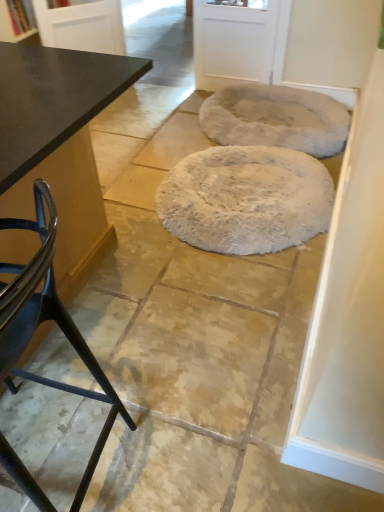
This screenshot has height=512, width=384. What do you see at coordinates (246, 199) in the screenshot? I see `white fluffy rug at center, acting as the second mat starting from the back` at bounding box center [246, 199].

Locate an element on the screen. The height and width of the screenshot is (512, 384). fuzzy gray mat at upper right, arranged as the 2th mat when viewed from the front is located at coordinates (276, 119).

Locate an element on the screen. The image size is (384, 512). white matte screen door at upper center, arranged as the first screen door when viewed from the right is located at coordinates (233, 42).

At what (x,y) coordinates should I click in order to perform the action: click on white fluffy rug at center, acting as the second mat starting from the back. Please return your answer as a coordinate pair (x, y). Image resolution: width=384 pixels, height=512 pixels. Looking at the image, I should click on (246, 199).

In the scene shown: Does glossy black table at upper left, the 2th screen door from the right, have a lesser width compared to black matte table at left?

Yes, glossy black table at upper left, the 2th screen door from the right, is thinner than black matte table at left.

Considering the relative positions of glossy black table at upper left, the 2th screen door from the right, and black matte table at left in the image provided, is glossy black table at upper left, the 2th screen door from the right, to the right of black matte table at left from the viewer's perspective?

In fact, glossy black table at upper left, the 2th screen door from the right, is to the left of black matte table at left.

Does glossy black table at upper left, the 2th screen door from the right, have a larger size compared to black matte table at left?

No, glossy black table at upper left, the 2th screen door from the right, is not bigger than black matte table at left.

From the image's perspective, is white fluffy rug at center, the 1th mat when ordered from front to back, on fuzzy gray mat at upper right, acting as the 1th mat starting from the back?

Incorrect, from the image's perspective, white fluffy rug at center, the 1th mat when ordered from front to back, is lower than fuzzy gray mat at upper right, acting as the 1th mat starting from the back.

From a real-world perspective, which object stands above the other?

From a 3D spatial view, fuzzy gray mat at upper right, acting as the 1th mat starting from the back, is above.

Does white fluffy rug at center, acting as the second mat starting from the back, have a lesser width compared to fuzzy gray mat at upper right, acting as the 1th mat starting from the back?

Indeed, white fluffy rug at center, acting as the second mat starting from the back, has a lesser width compared to fuzzy gray mat at upper right, acting as the 1th mat starting from the back.

I want to click on mat above the white fluffy rug at center, acting as the second mat starting from the back (from a real-world perspective), so click(x=276, y=119).

Looking at their sizes, would you say glossy black table at upper left, the 2th screen door from the right, is wider or thinner than white matte screen door at upper center, arranged as the first screen door when viewed from the right?

Clearly, glossy black table at upper left, the 2th screen door from the right, has less width compared to white matte screen door at upper center, arranged as the first screen door when viewed from the right.

From the image's perspective, which one is positioned higher, glossy black table at upper left, arranged as the first screen door when viewed from the left, or white matte screen door at upper center, placed as the 2th screen door when sorted from left to right?

glossy black table at upper left, arranged as the first screen door when viewed from the left.

Which object is further away from the camera, glossy black table at upper left, the 2th screen door from the right, or white matte screen door at upper center, arranged as the first screen door when viewed from the right?

Positioned behind is glossy black table at upper left, the 2th screen door from the right.

Between point (42, 26) and point (216, 87), which one is positioned in front?

The point (42, 26) is in front.

Consider the image. Measure the distance from white matte screen door at upper center, arranged as the first screen door when viewed from the right, to black matte table at left.

white matte screen door at upper center, arranged as the first screen door when viewed from the right, and black matte table at left are 6.66 feet apart from each other.

From the image's perspective, which one is positioned higher, white matte screen door at upper center, placed as the 2th screen door when sorted from left to right, or black matte table at left?

white matte screen door at upper center, placed as the 2th screen door when sorted from left to right.

Which is in front, white matte screen door at upper center, arranged as the first screen door when viewed from the right, or black matte table at left?

black matte table at left.

Looking at this image, is white matte screen door at upper center, placed as the 2th screen door when sorted from left to right, next to black matte table at left and touching it?

No, white matte screen door at upper center, placed as the 2th screen door when sorted from left to right, is not next to black matte table at left.

In the scene shown: Between white fluffy rug at center, the 1th mat when ordered from front to back, and white matte screen door at upper center, placed as the 2th screen door when sorted from left to right, which one has larger width?

Wider between the two is white fluffy rug at center, the 1th mat when ordered from front to back.

Is white fluffy rug at center, acting as the second mat starting from the back, completely or partially outside of white matte screen door at upper center, placed as the 2th screen door when sorted from left to right?

Yes, white fluffy rug at center, acting as the second mat starting from the back, is located beyond the bounds of white matte screen door at upper center, placed as the 2th screen door when sorted from left to right.

From a real-world perspective, is white fluffy rug at center, acting as the second mat starting from the back, physically above white matte screen door at upper center, arranged as the first screen door when viewed from the right?

Actually, white fluffy rug at center, acting as the second mat starting from the back, is physically below white matte screen door at upper center, arranged as the first screen door when viewed from the right, in the real world.

Can you confirm if matte black chair at left is smaller than glossy black table at upper left, arranged as the first screen door when viewed from the left?

Incorrect, matte black chair at left is not smaller in size than glossy black table at upper left, arranged as the first screen door when viewed from the left.

How many degrees apart are the facing directions of matte black chair at left and glossy black table at upper left, arranged as the first screen door when viewed from the left?

The angular difference between matte black chair at left and glossy black table at upper left, arranged as the first screen door when viewed from the left, is 139 degrees.

Are matte black chair at left and glossy black table at upper left, the 2th screen door from the right, beside each other?

No, matte black chair at left is not in contact with glossy black table at upper left, the 2th screen door from the right.

Is matte black chair at left at the right side of glossy black table at upper left, the 2th screen door from the right?

Yes, matte black chair at left is to the right of glossy black table at upper left, the 2th screen door from the right.

Can you confirm if white matte screen door at upper center, arranged as the first screen door when viewed from the right, is shorter than fuzzy gray mat at upper right, arranged as the 2th mat when viewed from the front?

In fact, white matte screen door at upper center, arranged as the first screen door when viewed from the right, may be taller than fuzzy gray mat at upper right, arranged as the 2th mat when viewed from the front.

Does white matte screen door at upper center, placed as the 2th screen door when sorted from left to right, contain fuzzy gray mat at upper right, acting as the 1th mat starting from the back?

No, white matte screen door at upper center, placed as the 2th screen door when sorted from left to right, does not contain fuzzy gray mat at upper right, acting as the 1th mat starting from the back.

Does white matte screen door at upper center, arranged as the first screen door when viewed from the right, touch fuzzy gray mat at upper right, acting as the 1th mat starting from the back?

There is a gap between white matte screen door at upper center, arranged as the first screen door when viewed from the right, and fuzzy gray mat at upper right, acting as the 1th mat starting from the back.

Which is closer, (233, 74) or (330, 97)?

Positioned in front is point (330, 97).

What are the coordinates of `table that is in front of the glossy black table at upper left, arranged as the first screen door when viewed from the left` in the screenshot? It's located at (59, 144).

Locate an element on the screen. The width and height of the screenshot is (384, 512). mat below the fuzzy gray mat at upper right, arranged as the 2th mat when viewed from the front (from the image's perspective) is located at coordinates (246, 199).

Looking at the image, which one is located closer to fuzzy gray mat at upper right, arranged as the 2th mat when viewed from the front, glossy black table at upper left, arranged as the first screen door when viewed from the left, or black matte table at left?

glossy black table at upper left, arranged as the first screen door when viewed from the left, is closer to fuzzy gray mat at upper right, arranged as the 2th mat when viewed from the front.

Considering their positions, is black matte table at left positioned closer to fuzzy gray mat at upper right, acting as the 1th mat starting from the back, than white matte screen door at upper center, placed as the 2th screen door when sorted from left to right?

Among the two, white matte screen door at upper center, placed as the 2th screen door when sorted from left to right, is located nearer to fuzzy gray mat at upper right, acting as the 1th mat starting from the back.

From the image, which object appears to be nearer to white matte screen door at upper center, arranged as the first screen door when viewed from the right, black matte table at left or glossy black table at upper left, arranged as the first screen door when viewed from the left?

Based on the image, glossy black table at upper left, arranged as the first screen door when viewed from the left, appears to be nearer to white matte screen door at upper center, arranged as the first screen door when viewed from the right.

Based on their spatial positions, is fuzzy gray mat at upper right, acting as the 1th mat starting from the back, or matte black chair at left closer to black matte table at left?

matte black chair at left is closer to black matte table at left.

Looking at the image, which one is located further to matte black chair at left, white matte screen door at upper center, placed as the 2th screen door when sorted from left to right, or black matte table at left?

white matte screen door at upper center, placed as the 2th screen door when sorted from left to right, lies further to matte black chair at left than the other object.

Estimate the real-world distances between objects in this image. Which object is further from glossy black table at upper left, arranged as the first screen door when viewed from the left, white matte screen door at upper center, arranged as the first screen door when viewed from the right, or black matte table at left?

Based on the image, black matte table at left appears to be further to glossy black table at upper left, arranged as the first screen door when viewed from the left.

Which object lies nearer to the anchor point white matte screen door at upper center, arranged as the first screen door when viewed from the right, black matte table at left or white fluffy rug at center, the 1th mat when ordered from front to back?

white fluffy rug at center, the 1th mat when ordered from front to back.

Consider the image. Based on their spatial positions, is matte black chair at left or white matte screen door at upper center, arranged as the first screen door when viewed from the right, further from fuzzy gray mat at upper right, arranged as the 2th mat when viewed from the front?

Based on the image, matte black chair at left appears to be further to fuzzy gray mat at upper right, arranged as the 2th mat when viewed from the front.

What are the coordinates of `screen door situated between glossy black table at upper left, arranged as the first screen door when viewed from the left, and fuzzy gray mat at upper right, arranged as the 2th mat when viewed from the front, from left to right` in the screenshot? It's located at (233, 42).

Where is `mat between glossy black table at upper left, the 2th screen door from the right, and fuzzy gray mat at upper right, acting as the 1th mat starting from the back`? This screenshot has width=384, height=512. mat between glossy black table at upper left, the 2th screen door from the right, and fuzzy gray mat at upper right, acting as the 1th mat starting from the back is located at coordinates [x=246, y=199].

What are the coordinates of `table located between matte black chair at left and fuzzy gray mat at upper right, acting as the 1th mat starting from the back, in the depth direction` in the screenshot? It's located at (59, 144).

You are a GUI agent. You are given a task and a screenshot of the screen. Output one action in this format:
    pyautogui.click(x=<x>, y=<y>)
    Task: Click on the mat between black matte table at left and fuzzy gray mat at upper right, acting as the 1th mat starting from the back, along the z-axis
    The width and height of the screenshot is (384, 512).
    Given the screenshot: What is the action you would take?
    pyautogui.click(x=246, y=199)